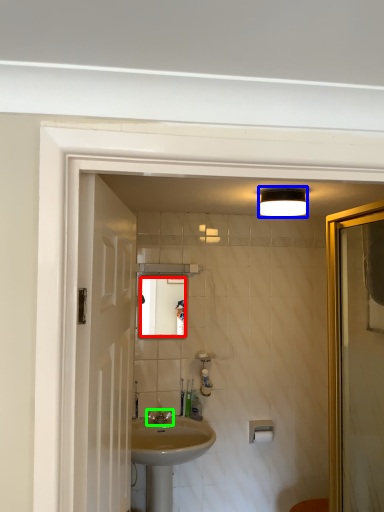
Question: Which object is positioned farthest from mirror (highlighted by a red box)? Select from light fixture (highlighted by a blue box) and tap (highlighted by a green box).

Choices:
 (A) light fixture
 (B) tap

Answer: (A)